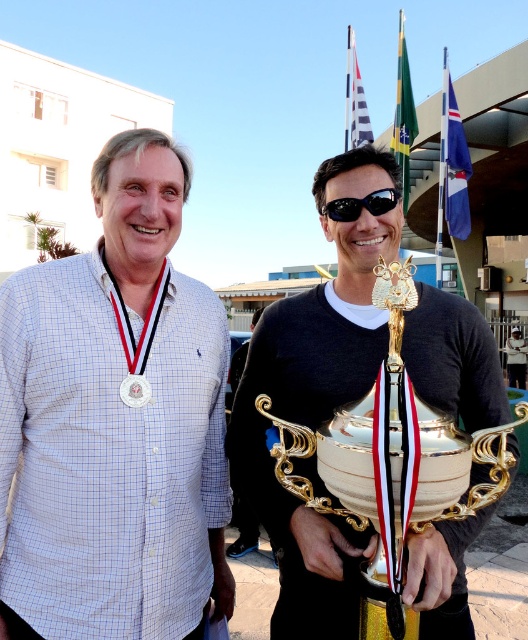
Question: In this image, where is black plastic goggles at center located relative to gold metallic medal at center?

Choices:
 (A) below
 (B) above

Answer: (B)

Question: Which of the following is the farthest from the observer?

Choices:
 (A) (403, 44)
 (B) (360, 144)

Answer: (A)

Question: Which point is farther to the camera?

Choices:
 (A) white fabric flag at upper center
 (B) black plastic goggles at center

Answer: (A)

Question: Estimate the real-world distances between objects in this image. Which object is farther from the gold plated trophy at center?

Choices:
 (A) white fabric flag at upper center
 (B) black plastic goggles at center

Answer: (A)

Question: Can you confirm if green fabric flag at upper center is thinner than black plastic goggles at center?

Choices:
 (A) yes
 (B) no

Answer: (B)

Question: Does gold metallic owl at center appear under gold metallic medal at center?

Choices:
 (A) no
 (B) yes

Answer: (A)